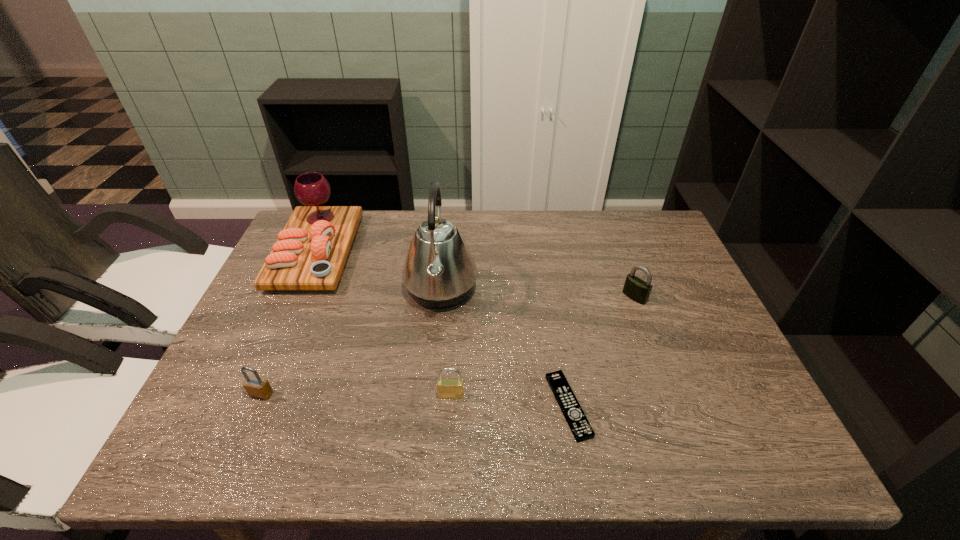
You are a GUI agent. You are given a task and a screenshot of the screen. Output one action in this format:
    pyautogui.click(x=<x>, y=<y>)
    Task: Click on the free spot between the second padlock from right to left and the kettle
    This screenshot has height=540, width=960.
    Given the screenshot: What is the action you would take?
    pyautogui.click(x=446, y=342)

The image size is (960, 540). Identify the location of free space between the platter and the leftmost padlock. (289, 323).

The width and height of the screenshot is (960, 540). What are the coordinates of `empty location between the second tallest object and the tallest object` in the screenshot? It's located at (379, 271).

Where is `empty space that is in between the farthest padlock and the fifth object from left to right`? This screenshot has width=960, height=540. empty space that is in between the farthest padlock and the fifth object from left to right is located at coordinates (601, 352).

Locate an element on the screen. The width and height of the screenshot is (960, 540). unoccupied area between the leftmost padlock and the farthest padlock is located at coordinates (448, 346).

You are a GUI agent. You are given a task and a screenshot of the screen. Output one action in this format:
    pyautogui.click(x=<x>, y=<y>)
    Task: Click on the object that is the closest to the fifth object from left to right
    The height and width of the screenshot is (540, 960).
    Given the screenshot: What is the action you would take?
    pyautogui.click(x=447, y=388)

Where is `object that is the fifth nearest to the second padlock from right to left`? The image size is (960, 540). object that is the fifth nearest to the second padlock from right to left is located at coordinates (636, 289).

Point out which padlock is positioned as the nearest to the second tallest object. Please provide its 2D coordinates. Your answer should be formatted as a tuple, i.e. [(x, y)], where the tuple contains the x and y coordinates of a point satisfying the conditions above.

[(256, 386)]

The width and height of the screenshot is (960, 540). Find the location of `padlock that is the nearest to the remote control`. padlock that is the nearest to the remote control is located at coordinates (447, 388).

This screenshot has width=960, height=540. In order to click on blank space that satisfies the following two spatial constraints: 1. from the spout of the kettle; 2. on the right side of the rightmost object in this screenshot , I will do `click(440, 297)`.